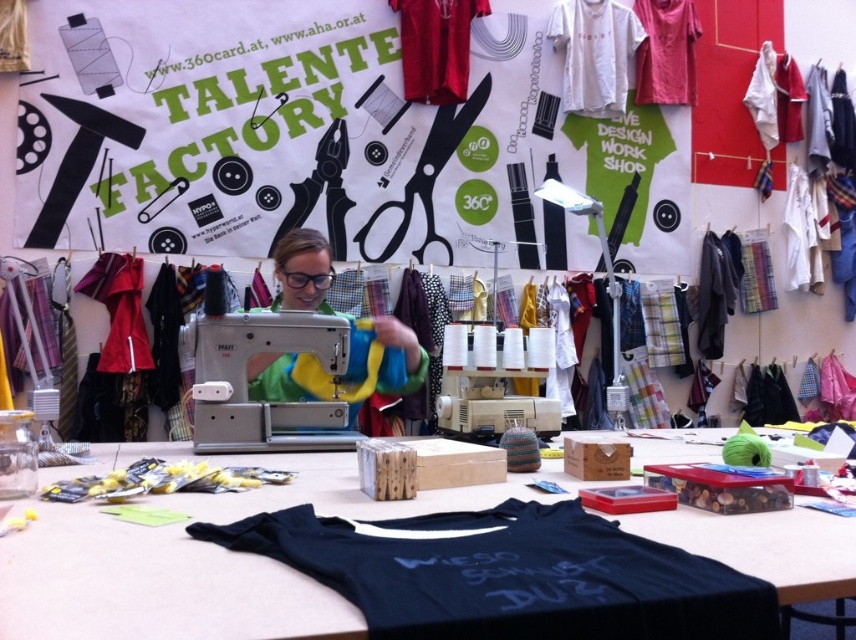
Is dark blue jersey at center to the right of white cotton t-shirt at upper center from the viewer's perspective?

Incorrect, dark blue jersey at center is not on the right side of white cotton t-shirt at upper center.

Does dark blue jersey at center have a smaller size compared to white cotton t-shirt at upper center?

Yes.

Is point (667, 586) in front of point (615, 19)?

Yes, point (667, 586) is in front of point (615, 19).

Where is `dark blue jersey at center`? This screenshot has height=640, width=856. dark blue jersey at center is located at coordinates (510, 576).

Can you confirm if black fabric shirt at center is bigger than white cotton t-shirt at upper center?

Indeed, black fabric shirt at center has a larger size compared to white cotton t-shirt at upper center.

Locate an element on the screen. The width and height of the screenshot is (856, 640). black fabric shirt at center is located at coordinates (152, 586).

Between black fabric shirt at center and metallic sewing machine at center, which one is positioned higher?

metallic sewing machine at center

Does point (752, 513) come closer to viewer compared to point (307, 285)?

That is True.

Does point (764, 518) lie in front of point (295, 291)?

Yes, it is in front of point (295, 291).

Identify the location of black fabric shirt at center. This screenshot has width=856, height=640. (152, 586).